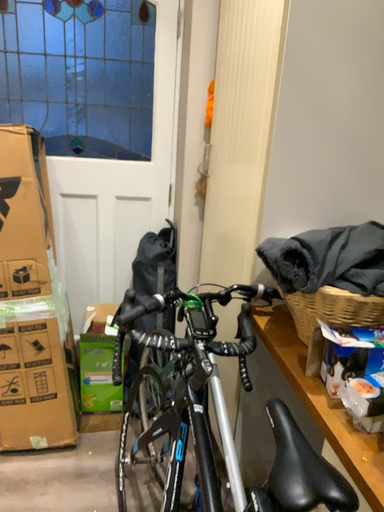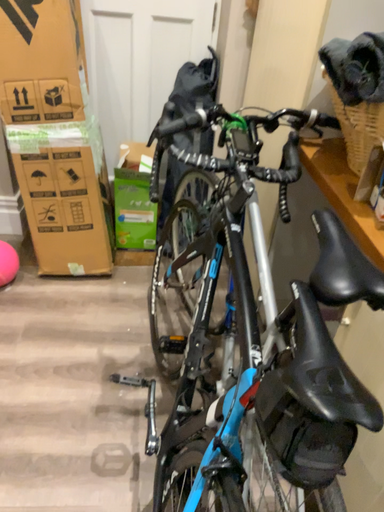
Question: How did the camera likely rotate when shooting the video?

Choices:
 (A) rotated downward
 (B) rotated upward

Answer: (A)